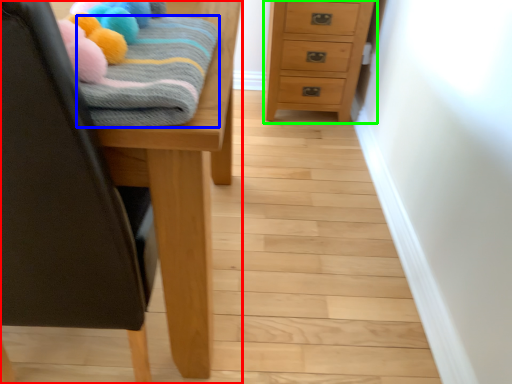
Question: Which object is the closest to the furniture (highlighted by a red box)? Choose among these: bath towel (highlighted by a blue box) or chest of drawers (highlighted by a green box).

Choices:
 (A) bath towel
 (B) chest of drawers

Answer: (A)